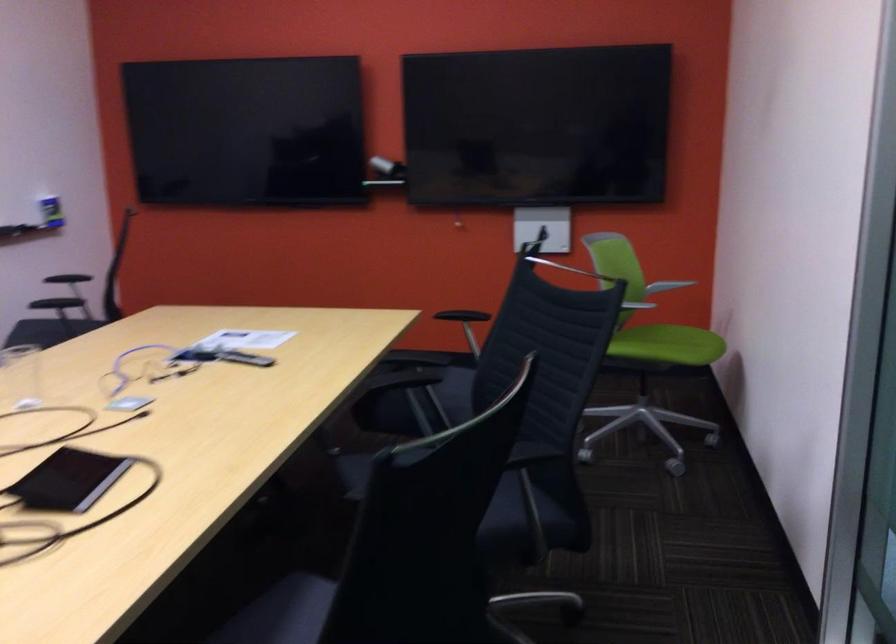
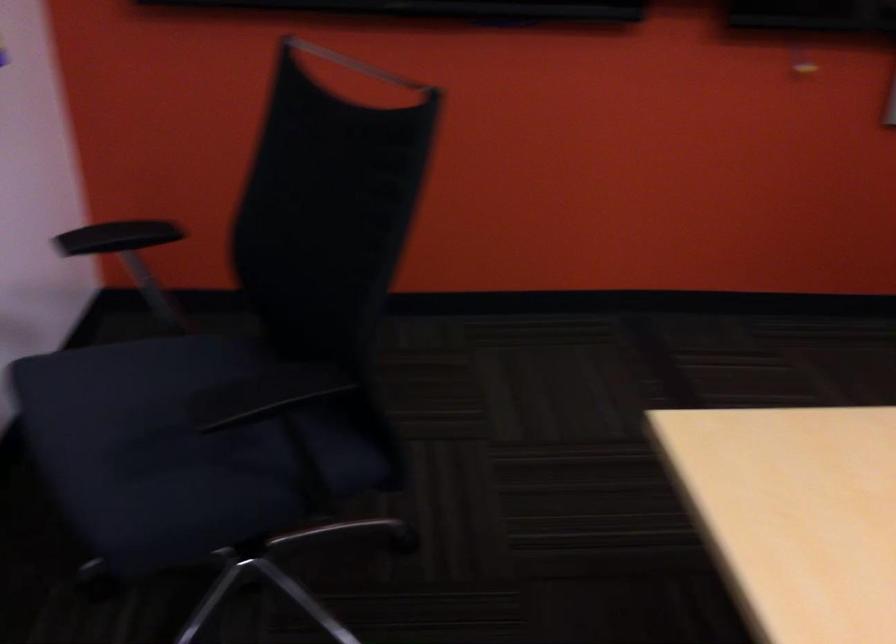
In the second image, find the point that corresponds to [237,212] in the first image.

(356, 64)